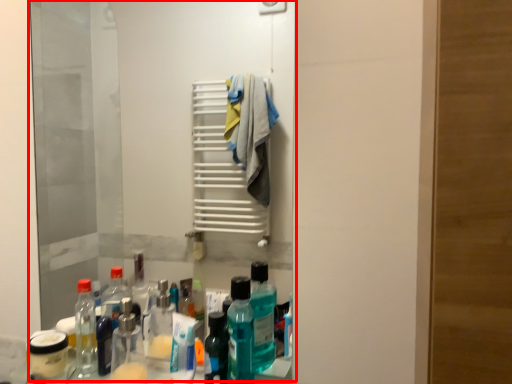
Question: Considering the relative positions of mirror (annotated by the red box) and bottle in the image provided, where is mirror (annotated by the red box) located with respect to the staircase?

Choices:
 (A) right
 (B) left

Answer: (B)